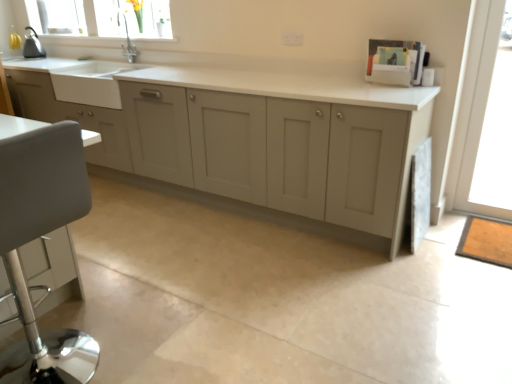
Question: Is clear glass window at upper left in front of or behind matte gray cabinets at center in the image?

Choices:
 (A) behind
 (B) front

Answer: (A)

Question: Does point (70, 0) appear closer or farther from the camera than point (350, 213)?

Choices:
 (A) farther
 (B) closer

Answer: (A)

Question: Which of these objects is positioned farthest from the white leather swivel chair at left?

Choices:
 (A) metallic gray kettle at upper left
 (B) white matte sink at left
 (C) clear glass window at upper left
 (D) transparent glass door at right
 (E) matte gray cabinets at center

Answer: (A)

Question: Which of these objects is positioned farthest from the white leather swivel chair at left?

Choices:
 (A) metallic gray kettle at upper left
 (B) white matte sink at left
 (C) clear glass window at upper left
 (D) transparent glass door at right
 (E) matte gray cabinets at center

Answer: (A)